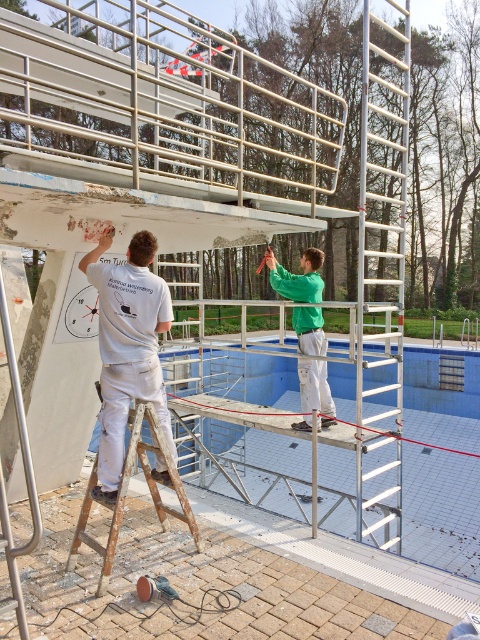
Does white matte t-shirt at upper left have a lesser height compared to rusty wood ladder at lower left?

Incorrect, white matte t-shirt at upper left's height does not fall short of rusty wood ladder at lower left's.

Who is more distant from viewer, (110, 461) or (120, 486)?

The point (110, 461) is behind.

Locate an element on the screen. white matte t-shirt at upper left is located at coordinates (128, 348).

In the scene shown: Can you confirm if blue tile swimming pool at center is positioned to the left of white matte t-shirt at upper left?

No, blue tile swimming pool at center is not to the left of white matte t-shirt at upper left.

Who is positioned more to the left, blue tile swimming pool at center or white matte t-shirt at upper left?

white matte t-shirt at upper left is more to the left.

Find the location of a particular element. Image resolution: width=480 pixels, height=640 pixels. blue tile swimming pool at center is located at coordinates (441, 509).

At what (x,y) coordinates should I click in order to perform the action: click on blue tile swimming pool at center. Please return your answer as a coordinate pair (x, y). This screenshot has width=480, height=640. Looking at the image, I should click on 441,509.

Is silver metallic ladder at upper center thinner than white matte t-shirt at upper left?

Incorrect, silver metallic ladder at upper center's width is not less than white matte t-shirt at upper left's.

Can you confirm if silver metallic ladder at upper center is positioned to the right of white matte t-shirt at upper left?

Yes, silver metallic ladder at upper center is to the right of white matte t-shirt at upper left.

Who is more distant from viewer, (391, 264) or (104, 353)?

The point (391, 264) is behind.

You are a GUI agent. You are given a task and a screenshot of the screen. Output one action in this format:
    pyautogui.click(x=<x>, y=<y>)
    Task: Click on the silver metallic ladder at upper center
    This screenshot has height=640, width=480.
    Given the screenshot: What is the action you would take?
    pyautogui.click(x=382, y=275)